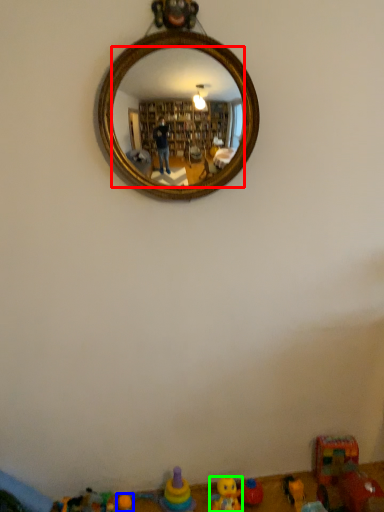
Question: Which object is the closest to the mirror (highlighted by a red box)? Choose among these: toy (highlighted by a blue box) or toy (highlighted by a green box).

Choices:
 (A) toy
 (B) toy

Answer: (B)